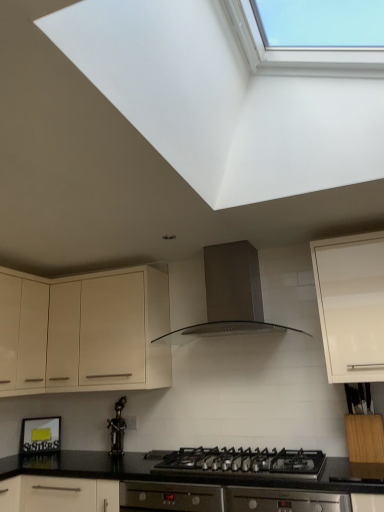
Question: From the image's perspective, is black matte gas stove at center over matte cream cabinet at upper left, the 2th cabinetry viewed from the front?

Choices:
 (A) no
 (B) yes

Answer: (A)

Question: From the image's perspective, is black matte gas stove at center beneath matte cream cabinet at upper left, marked as the 1th cabinetry in a left-to-right arrangement?

Choices:
 (A) yes
 (B) no

Answer: (A)

Question: Are black matte gas stove at center and matte cream cabinet at upper left, the 2th cabinetry viewed from the front, located far from each other?

Choices:
 (A) no
 (B) yes

Answer: (A)

Question: Does black matte gas stove at center have a smaller size compared to matte cream cabinet at upper left, arranged as the 2th cabinetry when viewed from the right?

Choices:
 (A) yes
 (B) no

Answer: (A)

Question: From a real-world perspective, is black matte gas stove at center on matte cream cabinet at upper left, arranged as the 2th cabinetry when viewed from the right?

Choices:
 (A) no
 (B) yes

Answer: (A)

Question: Relative to white glossy cabinet at upper right, which ranks as the 2th cabinetry in back-to-front order, is bronze statue at center in front or behind?

Choices:
 (A) behind
 (B) front

Answer: (A)

Question: Is bronze statue at center wider or thinner than white glossy cabinet at upper right, which is counted as the 1th cabinetry, starting from the right?

Choices:
 (A) thin
 (B) wide

Answer: (A)

Question: From a real-world perspective, is bronze statue at center physically located above or below white glossy cabinet at upper right, which appears as the 1th cabinetry when viewed from the front?

Choices:
 (A) above
 (B) below

Answer: (B)

Question: Is bronze statue at center to the left or to the right of white glossy cabinet at upper right, which appears as the 1th cabinetry when viewed from the front, in the image?

Choices:
 (A) right
 (B) left

Answer: (B)

Question: Is point (278, 326) positioned closer to the camera than point (238, 471)?

Choices:
 (A) farther
 (B) closer

Answer: (A)

Question: Looking at their shapes, would you say satin silver range hood at center is wider or thinner than black matte gas stove at center?

Choices:
 (A) thin
 (B) wide

Answer: (A)

Question: Do you think satin silver range hood at center is within black matte gas stove at center, or outside of it?

Choices:
 (A) outside
 (B) inside

Answer: (A)

Question: Considering their positions, is satin silver range hood at center located in front of or behind black matte gas stove at center?

Choices:
 (A) behind
 (B) front

Answer: (A)

Question: Does point (382, 332) appear closer or farther from the camera than point (226, 272)?

Choices:
 (A) farther
 (B) closer

Answer: (B)

Question: In terms of width, does white glossy cabinet at upper right, which appears as the 1th cabinetry when viewed from the front, look wider or thinner when compared to satin silver range hood at center?

Choices:
 (A) wide
 (B) thin

Answer: (B)